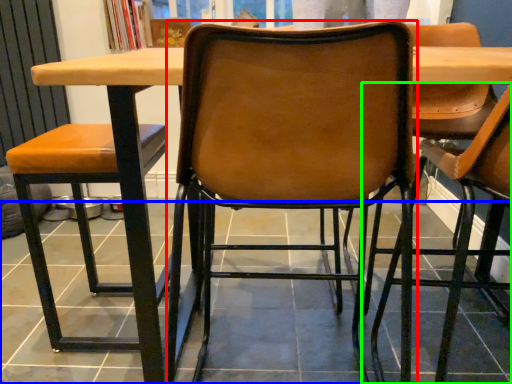
Question: Considering the real-world distances, which object is farthest from chair (highlighted by a red box)? tile (highlighted by a blue box) or chair (highlighted by a green box)?

Choices:
 (A) tile
 (B) chair

Answer: (B)